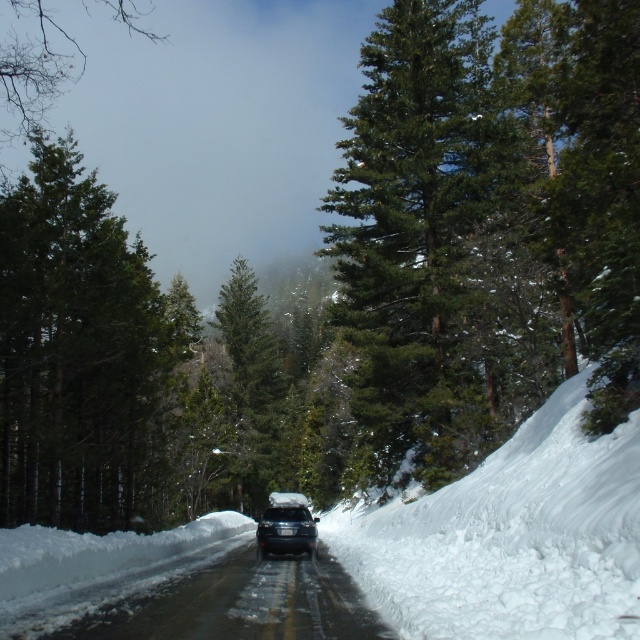
You are driving an SUV with a roof rack carrying camping gear. You notice the white fluffy snow at right and the green matte tree at center. Which object is closer to your vehicle as you drive forward on the snowy road?

The white fluffy snow at right is closer to the vehicle because it is positioned in front of the green matte tree at center, meaning it is nearer to the SUV as it moves forward.

You are a hiker planning to walk between the two trees in the scene. The green textured pine tree at center and the green matte tree at center are both in your path. Which tree will you encounter first if you walk straight ahead towards the road?

The green matte tree at center will be encountered first because it is shorter than the green textured pine tree at center, so it is closer to the observer.